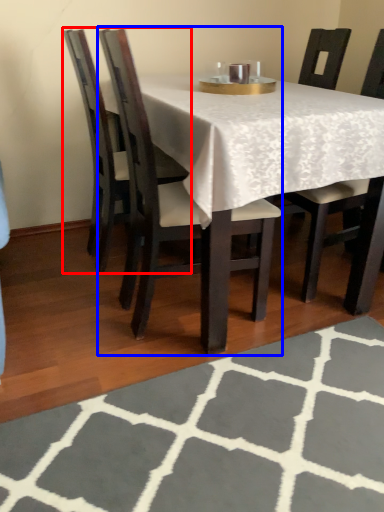
Question: Among these objects, which one is farthest to the camera, chair (highlighted by a red box) or chair (highlighted by a blue box)?

Choices:
 (A) chair
 (B) chair

Answer: (A)